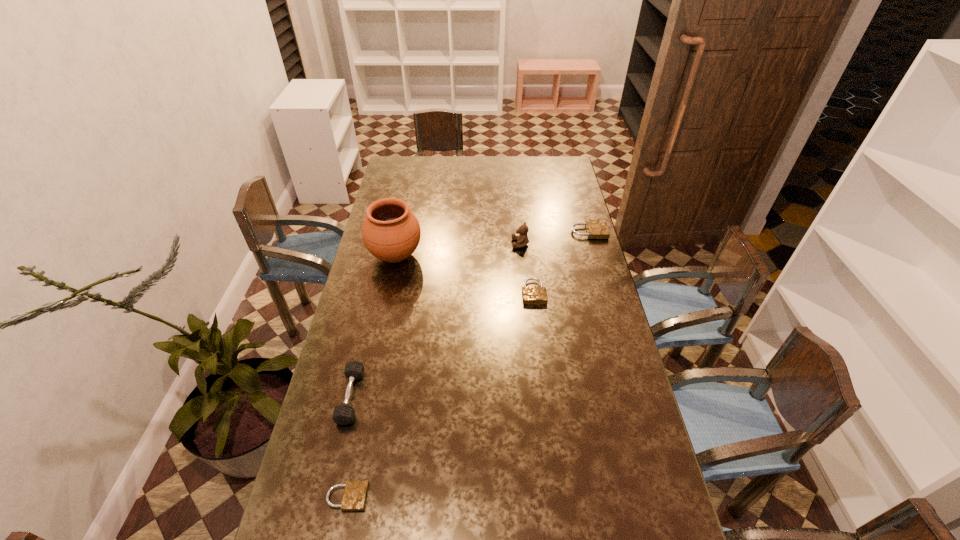
In order to click on dumbbell located at the left edge in this screenshot , I will do `click(343, 414)`.

Find the location of a particular element. object located in the right edge section of the desktop is located at coordinates (596, 229).

At what (x,y) coordinates should I click in order to perform the action: click on object located at the near left corner. Please return your answer as a coordinate pair (x, y). The width and height of the screenshot is (960, 540). Looking at the image, I should click on (355, 494).

Identify the location of blank area at the left edge. (368, 258).

Find the location of a particular element. This screenshot has width=960, height=540. vacant space at the right edge is located at coordinates (594, 256).

Identify the location of vacant space at the near right corner. The width and height of the screenshot is (960, 540). (619, 515).

Locate an element on the screen. This screenshot has width=960, height=540. vacant space that's between the second nearest padlock and the second nearest object is located at coordinates (443, 345).

At what (x,y) coordinates should I click in order to perform the action: click on vacant area that lies between the shortest padlock and the third nearest object. Please return your answer as a coordinate pair (x, y). Image resolution: width=960 pixels, height=540 pixels. Looking at the image, I should click on (441, 395).

Image resolution: width=960 pixels, height=540 pixels. Identify the location of vacant point located between the fourth shortest object and the leftmost padlock. (349, 447).

Image resolution: width=960 pixels, height=540 pixels. I want to click on vacant point located between the teddy bear and the rightmost padlock, so click(555, 238).